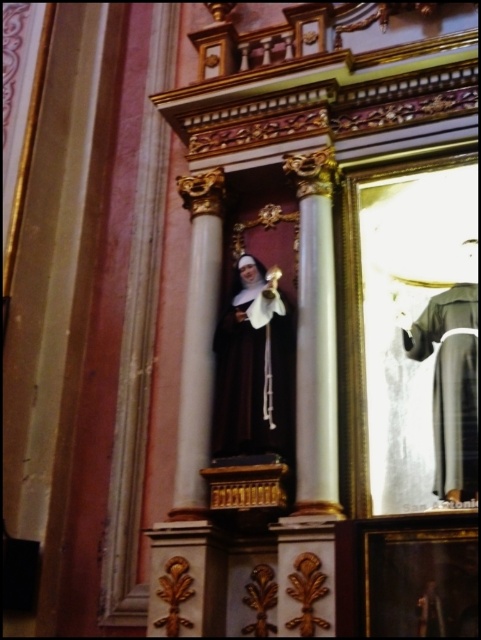
Can you confirm if matte black statue at center is wider than gray matte robe at right?

Correct, the width of matte black statue at center exceeds that of gray matte robe at right.

Between point (250, 326) and point (470, 388), which one is positioned behind?

The point (250, 326) is behind.

Is point (240, 289) positioned in front of point (447, 324)?

No, (240, 289) is further to viewer.

The height and width of the screenshot is (640, 481). I want to click on matte black statue at center, so click(251, 372).